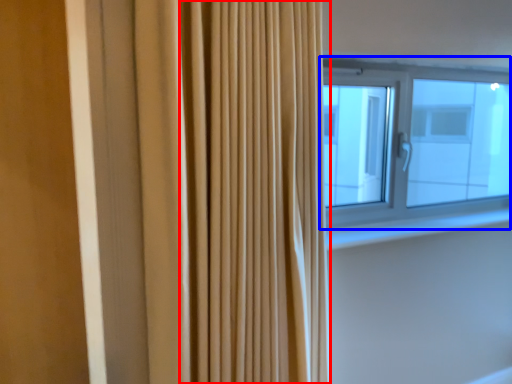
Question: Which point is further to the camera, shower curtain (highlighted by a red box) or window (highlighted by a blue box)?

Choices:
 (A) shower curtain
 (B) window

Answer: (B)